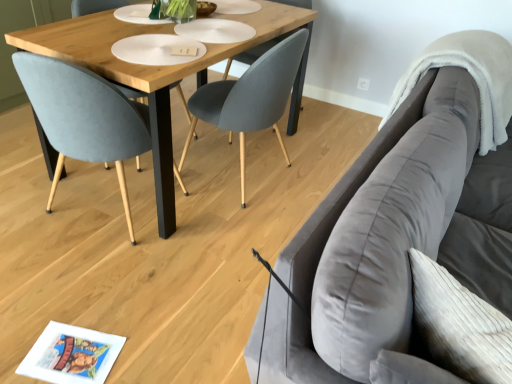
Identify the location of vacant space in front of velvet blue chair at center, which is counted as the 2th chair, starting from the right. (88, 282).